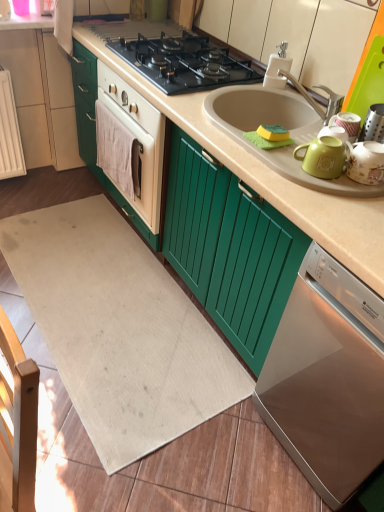
Locate an element on the screen. This screenshot has height=512, width=384. vacant space situated above beige carpet at lower left (from a real-world perspective) is located at coordinates (112, 328).